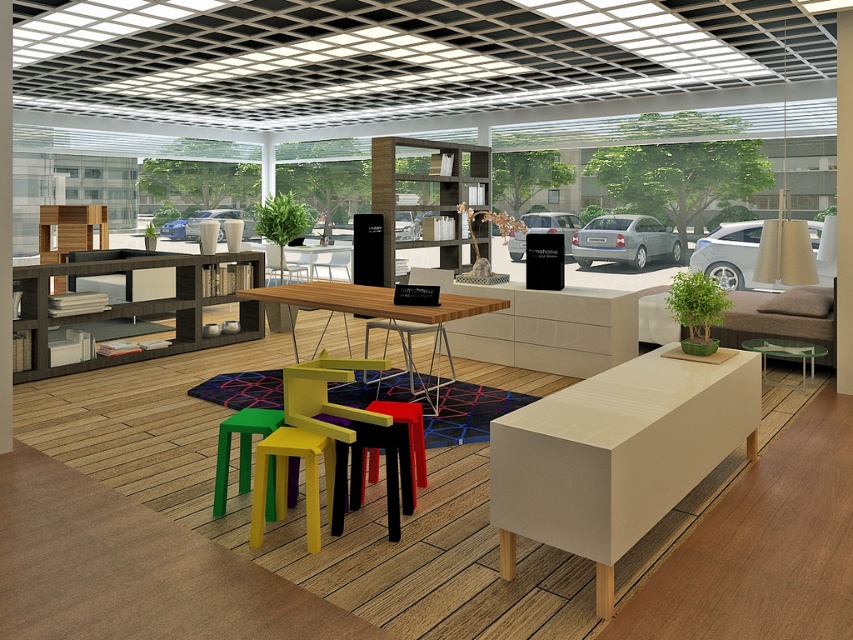
Is yellow matte bar stool at center smaller than matte black stool at center?

Yes.

The height and width of the screenshot is (640, 853). Find the location of `yellow matte bar stool at center`. yellow matte bar stool at center is located at coordinates (286, 477).

Describe the element at coordinates (286, 477) in the screenshot. I see `yellow matte bar stool at center` at that location.

The height and width of the screenshot is (640, 853). What are the coordinates of `yellow matte bar stool at center` in the screenshot? It's located at pos(286,477).

Who is taller, yellow matte chair at center or transparent glass table at center?

Standing taller between the two is yellow matte chair at center.

This screenshot has width=853, height=640. What do you see at coordinates (350, 435) in the screenshot? I see `yellow matte chair at center` at bounding box center [350, 435].

Where is `yellow matte chair at center`? yellow matte chair at center is located at coordinates coord(350,435).

Is yellow plastic bar stool at center shorter than yellow plastic chair at center?

Yes.

Is yellow plastic bar stool at center bigger than yellow plastic chair at center?

No, yellow plastic bar stool at center is not bigger than yellow plastic chair at center.

Who is more distant from viewer, (259,408) or (408,330)?

Positioned behind is point (408,330).

Where is `yellow plastic bar stool at center`? The image size is (853, 640). yellow plastic bar stool at center is located at coordinates (241, 449).